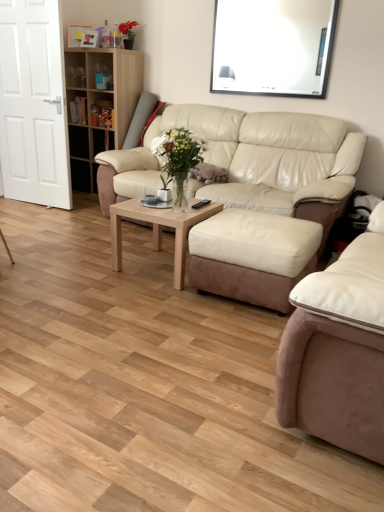
Question: Is light brown wood coffee table at center taller than beige leather couch at center, the 2th studio couch positioned from the front?

Choices:
 (A) yes
 (B) no

Answer: (B)

Question: Could beige leather couch at center, the 2th studio couch positioned from the front, be considered to be inside light brown wood coffee table at center?

Choices:
 (A) yes
 (B) no

Answer: (B)

Question: Does light brown wood coffee table at center appear on the left side of beige leather couch at center, which is counted as the first studio couch, starting from the back?

Choices:
 (A) no
 (B) yes

Answer: (B)

Question: Is light brown wood coffee table at center to the right of beige leather couch at center, which is counted as the first studio couch, starting from the back, from the viewer's perspective?

Choices:
 (A) no
 (B) yes

Answer: (A)

Question: Does light brown wood coffee table at center have a larger size compared to beige leather couch at center, which is counted as the first studio couch, starting from the back?

Choices:
 (A) yes
 (B) no

Answer: (B)

Question: Is the depth of light brown wood coffee table at center less than that of beige leather couch at center, which is counted as the first studio couch, starting from the back?

Choices:
 (A) no
 (B) yes

Answer: (B)

Question: Would you say wooden bookshelf at upper left is part of white glossy door at left's contents?

Choices:
 (A) no
 (B) yes

Answer: (A)

Question: From a real-world perspective, is white glossy door at left on wooden bookshelf at upper left?

Choices:
 (A) yes
 (B) no

Answer: (A)

Question: Is the depth of white glossy door at left greater than that of wooden bookshelf at upper left?

Choices:
 (A) yes
 (B) no

Answer: (B)

Question: Does white glossy door at left have a greater width compared to wooden bookshelf at upper left?

Choices:
 (A) yes
 (B) no

Answer: (B)

Question: Is white glossy door at left to the right of wooden bookshelf at upper left from the viewer's perspective?

Choices:
 (A) yes
 (B) no

Answer: (B)

Question: Considering the relative sizes of white glossy door at left and wooden bookshelf at upper left in the image provided, is white glossy door at left smaller than wooden bookshelf at upper left?

Choices:
 (A) yes
 (B) no

Answer: (A)

Question: From the image's perspective, is wooden bookshelf at upper left below white glossy door at left?

Choices:
 (A) yes
 (B) no

Answer: (B)